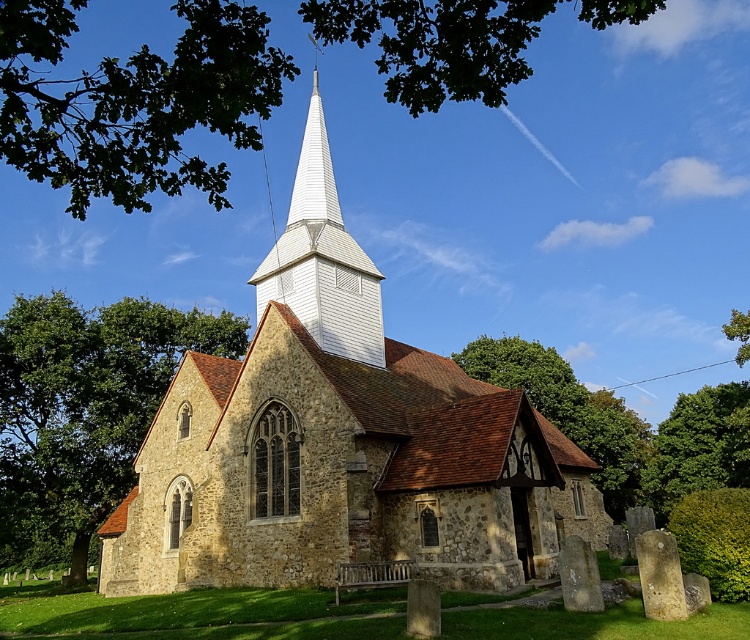
Question: Considering the relative positions of white wooden spire at center and yellowish stone gravestone at lower right in the image provided, where is white wooden spire at center located with respect to yellowish stone gravestone at lower right?

Choices:
 (A) above
 (B) below

Answer: (A)

Question: Which point is farther to the camera?

Choices:
 (A) green leafy tree at left
 (B) yellowish stone gravestone at lower right
 (C) stone church at center
 (D) green leafy tree at upper right

Answer: (D)

Question: Does stone church at center appear over green leafy tree at center?

Choices:
 (A) no
 (B) yes

Answer: (B)

Question: Does green leafy tree at left appear under white wooden spire at center?

Choices:
 (A) yes
 (B) no

Answer: (A)

Question: Which of the following is the closest to the observer?

Choices:
 (A) green leafy tree at lower right
 (B) white wooden spire at center
 (C) green leafy tree at upper right

Answer: (B)

Question: Which point is closer to the camera?

Choices:
 (A) (180, 45)
 (B) (366, 320)
 (C) (747, 336)

Answer: (A)